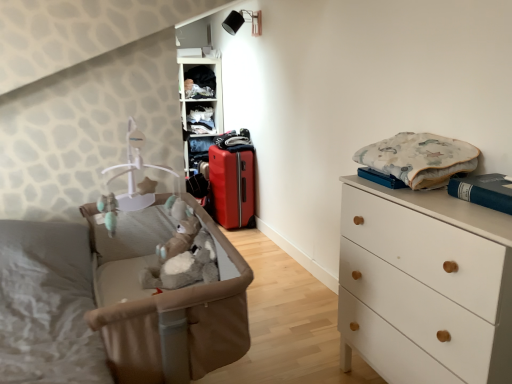
Question: Does matte plastic shelf at upper center, the 1th shelf positioned from the bottom, have a larger size compared to dark blue fabric at upper center, which ranks as the 1th clothing in left-to-right order?

Choices:
 (A) no
 (B) yes

Answer: (B)

Question: Is matte plastic shelf at upper center, the 1th shelf positioned from the bottom, positioned far away from dark blue fabric at upper center, which is the second clothing from front to back?

Choices:
 (A) yes
 (B) no

Answer: (B)

Question: From a real-world perspective, does matte plastic shelf at upper center, the 1th shelf positioned from the bottom, sit lower than dark blue fabric at upper center, the 1th clothing positioned from the top?

Choices:
 (A) no
 (B) yes

Answer: (B)

Question: Is matte plastic shelf at upper center, which is the second shelf in top-to-bottom order, wider than dark blue fabric at upper center, which is the second clothing from front to back?

Choices:
 (A) no
 (B) yes

Answer: (B)

Question: Is matte plastic shelf at upper center, which is the second shelf in top-to-bottom order, behind dark blue fabric at upper center, the 2th clothing in the bottom-to-top sequence?

Choices:
 (A) yes
 (B) no

Answer: (B)

Question: From the image's perspective, is matte plastic shelf at upper center, the 1th shelf positioned from the bottom, below dark blue fabric at upper center, the 2th clothing in the bottom-to-top sequence?

Choices:
 (A) no
 (B) yes

Answer: (B)

Question: Could you tell me if dark blue fabric at upper center, which is the second clothing from front to back, is turned towards matte red suitcase at center?

Choices:
 (A) yes
 (B) no

Answer: (B)

Question: Does dark blue fabric at upper center, which is counted as the first clothing, starting from the back, appear on the right side of matte red suitcase at center?

Choices:
 (A) yes
 (B) no

Answer: (B)

Question: From a real-world perspective, is dark blue fabric at upper center, the 1th clothing positioned from the top, physically below matte red suitcase at center?

Choices:
 (A) yes
 (B) no

Answer: (B)

Question: Is matte red suitcase at center located within dark blue fabric at upper center, which is counted as the first clothing, starting from the back?

Choices:
 (A) yes
 (B) no

Answer: (B)

Question: Is dark blue fabric at upper center, the 2th clothing in the bottom-to-top sequence, bigger than matte red suitcase at center?

Choices:
 (A) no
 (B) yes

Answer: (A)

Question: Can you confirm if dark blue fabric at upper center, acting as the second clothing starting from the right, is smaller than matte red suitcase at center?

Choices:
 (A) yes
 (B) no

Answer: (A)

Question: From a real-world perspective, is white matte chest of drawers at right on matte red suitcase at center?

Choices:
 (A) no
 (B) yes

Answer: (B)